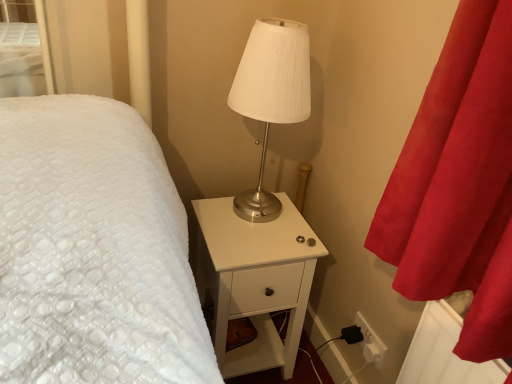
This screenshot has width=512, height=384. What are the coordinates of `satin white lamp at center` in the screenshot? It's located at [271, 96].

What do you see at coordinates (271, 96) in the screenshot? I see `satin white lamp at center` at bounding box center [271, 96].

This screenshot has height=384, width=512. What do you see at coordinates (256, 280) in the screenshot? I see `white glossy nightstand at center` at bounding box center [256, 280].

Where is `white glossy nightstand at center`? white glossy nightstand at center is located at coordinates (256, 280).

This screenshot has width=512, height=384. In order to click on satin white lamp at center in this screenshot , I will do tap(271, 96).

Which is more to the left, satin white lamp at center or white glossy nightstand at center?

white glossy nightstand at center.

Which object is more forward, satin white lamp at center or white glossy nightstand at center?

Positioned in front is satin white lamp at center.

Is point (279, 116) closer or farther from the camera than point (282, 269)?

Point (279, 116).

From the image's perspective, who appears lower, satin white lamp at center or white glossy nightstand at center?

white glossy nightstand at center appears lower in the image.

From a real-world perspective, is satin white lamp at center under white glossy nightstand at center?

Actually, satin white lamp at center is physically above white glossy nightstand at center in the real world.

Consider the image. Does satin white lamp at center have a greater width compared to white glossy nightstand at center?

No, satin white lamp at center is not wider than white glossy nightstand at center.

Which of these two, satin white lamp at center or white glossy nightstand at center, stands taller?

white glossy nightstand at center is taller.

Between satin white lamp at center and white glossy nightstand at center, which one has smaller size?

satin white lamp at center is smaller.

Is satin white lamp at center not inside white glossy nightstand at center?

Absolutely, satin white lamp at center is external to white glossy nightstand at center.

Is satin white lamp at center not close to white glossy nightstand at center?

No, satin white lamp at center is in close proximity to white glossy nightstand at center.

Is satin white lamp at center positioned with its back to white glossy nightstand at center?

That's not correct — satin white lamp at center is not looking away from white glossy nightstand at center.

Where is `nightstand behind the satin white lamp at center`? Image resolution: width=512 pixels, height=384 pixels. nightstand behind the satin white lamp at center is located at coordinates (256, 280).

Is white glossy nightstand at center at the left side of satin white lamp at center?

Indeed, white glossy nightstand at center is positioned on the left side of satin white lamp at center.

Which object is more forward, white glossy nightstand at center or satin white lamp at center?

satin white lamp at center is more forward.

Is point (264, 339) more distant than point (294, 30)?

Yes.

Looking at this image, from the image's perspective, is white glossy nightstand at center below satin white lamp at center?

Yes, from the image's perspective, white glossy nightstand at center is below satin white lamp at center.

From a real-world perspective, between white glossy nightstand at center and satin white lamp at center, who is vertically higher?

satin white lamp at center.

Is white glossy nightstand at center wider than satin white lamp at center?

Correct, the width of white glossy nightstand at center exceeds that of satin white lamp at center.

Does white glossy nightstand at center have a greater height compared to satin white lamp at center?

Yes.

Does white glossy nightstand at center have a larger size compared to satin white lamp at center?

Indeed, white glossy nightstand at center has a larger size compared to satin white lamp at center.

Is white glossy nightstand at center inside or outside of satin white lamp at center?

white glossy nightstand at center is not enclosed by satin white lamp at center.

Is white glossy nightstand at center next to satin white lamp at center and touching it?

No, white glossy nightstand at center is not touching satin white lamp at center.

Is white glossy nightstand at center turned away from satin white lamp at center?

That's not correct — white glossy nightstand at center is not looking away from satin white lamp at center.

What's the angular difference between white glossy nightstand at center and satin white lamp at center's facing directions?

The facing directions of white glossy nightstand at center and satin white lamp at center are 0.231 degrees apart.

How distant is white glossy nightstand at center from satin white lamp at center?

47.88 centimeters.

I want to click on nightstand on the left of the satin white lamp at center, so click(x=256, y=280).

This screenshot has width=512, height=384. I want to click on nightstand located underneath the satin white lamp at center (from a real-world perspective), so [256, 280].

Locate an element on the screen. The width and height of the screenshot is (512, 384). lamp that is above the white glossy nightstand at center (from the image's perspective) is located at coordinates click(x=271, y=96).